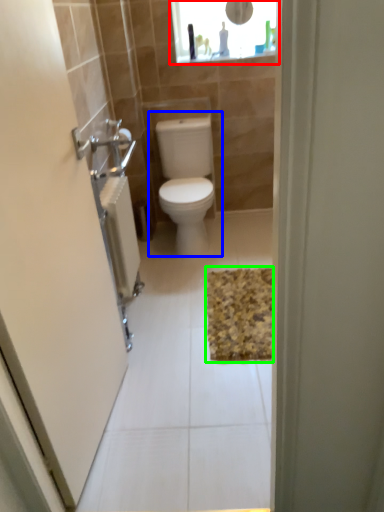
Question: Considering the real-world distances, which object is farthest from medicine cabinet (highlighted by a red box)? toilet (highlighted by a blue box) or bath mat (highlighted by a green box)?

Choices:
 (A) toilet
 (B) bath mat

Answer: (B)